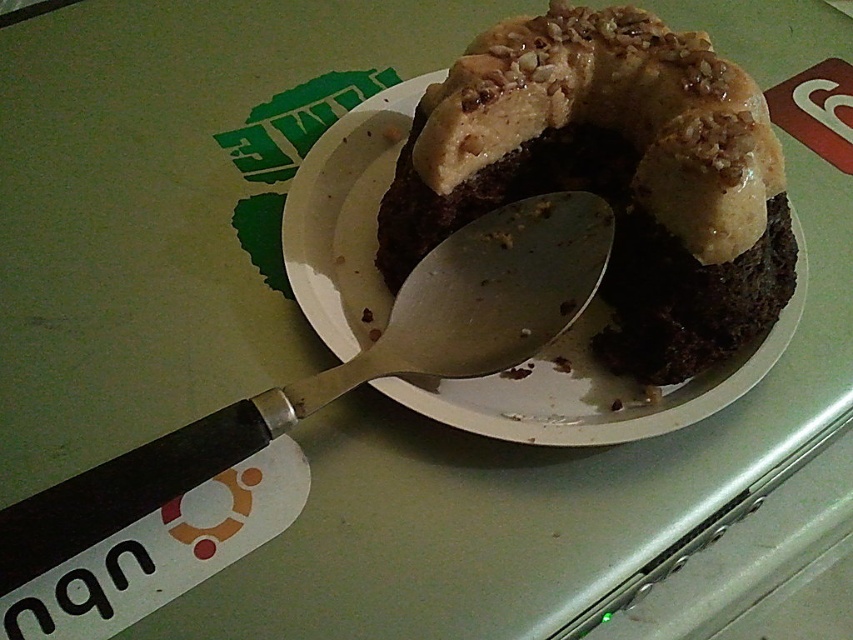
You are trying to determine if the chocolatesmoothcake at center will fit into a container that can only hold items shorter than the black plastic spoon at upper left. Based on the scene, can the cake fit?

The chocolatesmoothcake at center is much taller than the black plastic spoon at upper left, so it cannot fit into the container since it exceeds the height limit.

You are a robot with a 5.5 inch wide arm. You need to pick up the black plastic spoon at upper left from the chocolatesmoothcake at center. Can your arm fit between them without touching either?

The distance between the chocolatesmoothcake at center and the black plastic spoon at upper left is 7.00 inches, which is wider than your 5.5 inch arm. Therefore, your arm can fit between them without touching either.